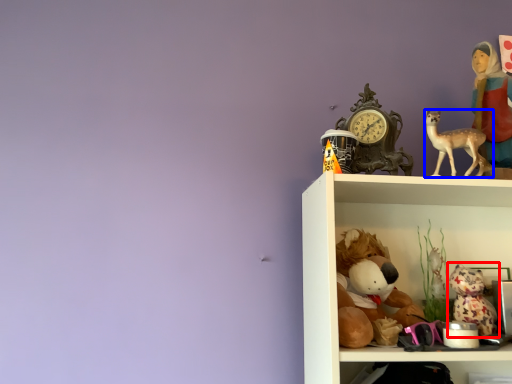
Question: Which point is further to the camera, toy (highlighted by a red box) or deer (highlighted by a blue box)?

Choices:
 (A) toy
 (B) deer

Answer: (A)